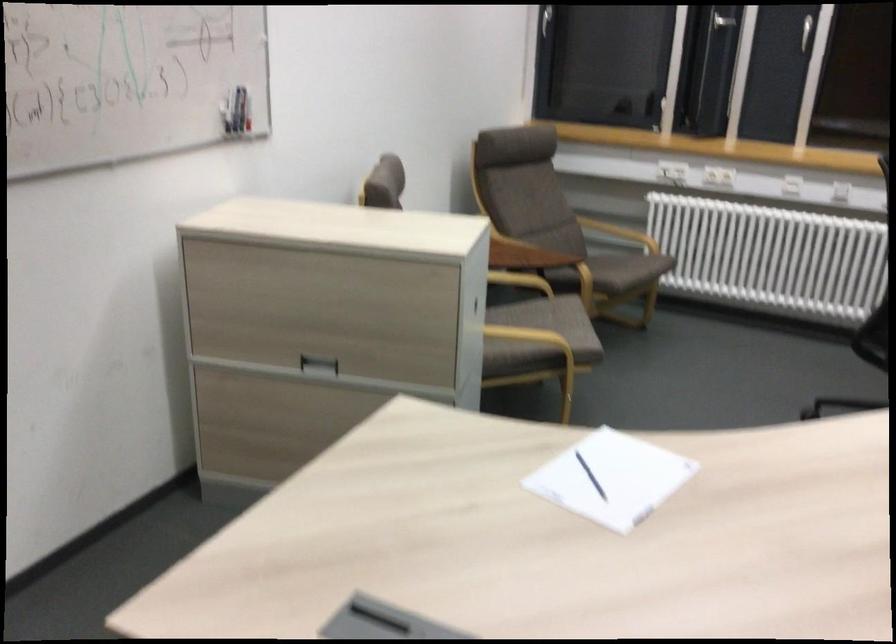
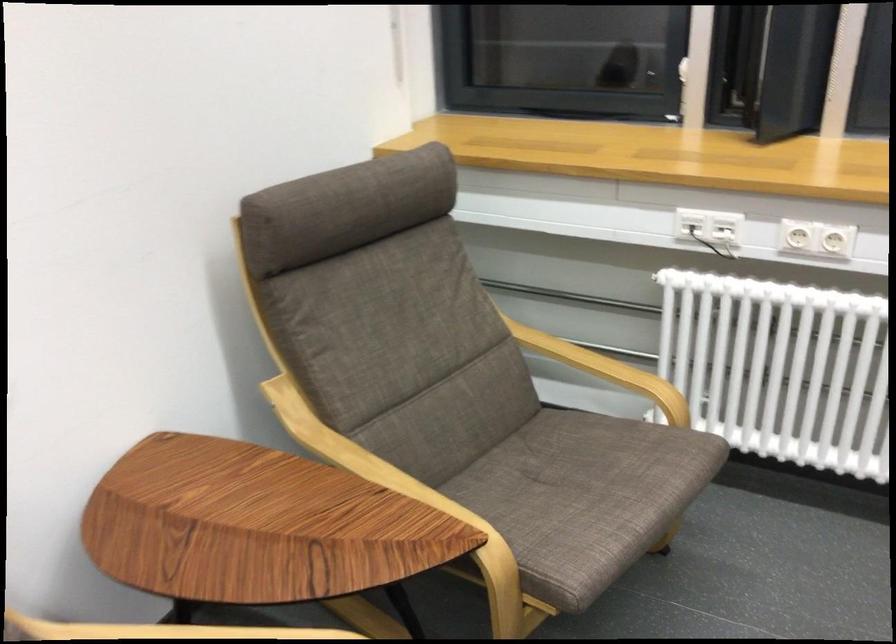
Question: The images are taken continuously from a first-person perspective. In which direction are you moving?

Choices:
 (A) Left
 (B) Right
 (C) Forward
 (D) Backward

Answer: (C)